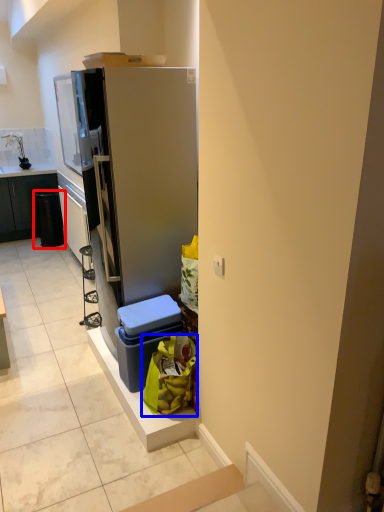
Question: Which of the following is the closest to the observer, recycling bin (highlighted by a red box) or garbage (highlighted by a blue box)?

Choices:
 (A) recycling bin
 (B) garbage

Answer: (B)